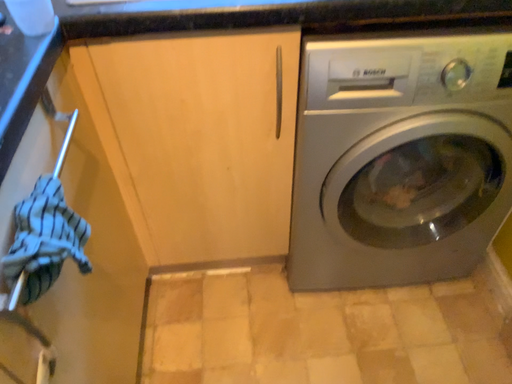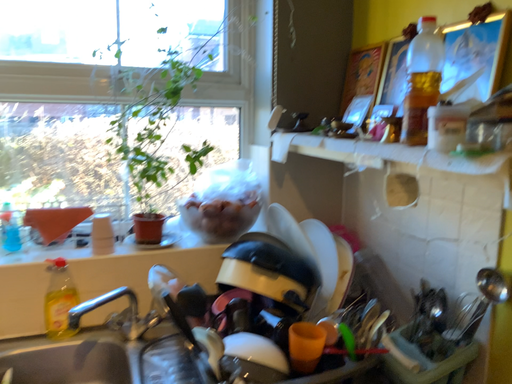
Question: Which way did the camera rotate in the video?

Choices:
 (A) rotated downward
 (B) rotated upward

Answer: (B)